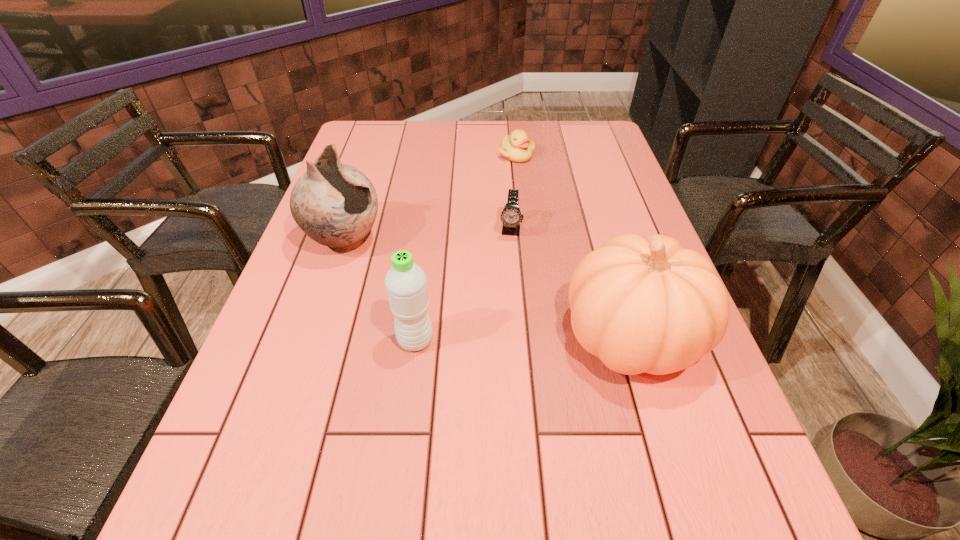
The width and height of the screenshot is (960, 540). I want to click on vacant space at the far edge of the desktop, so click(428, 150).

What are the coordinates of `vacant space at the near edge of the desktop` in the screenshot? It's located at (528, 458).

The width and height of the screenshot is (960, 540). I want to click on vacant area at the left edge, so 293,267.

Where is `free space at the right edge of the desktop`? The image size is (960, 540). free space at the right edge of the desktop is located at coordinates (589, 157).

You are a GUI agent. You are given a task and a screenshot of the screen. Output one action in this format:
    pyautogui.click(x=<x>, y=<y>)
    Task: Click on the free space at the far left corner of the desktop
    The width and height of the screenshot is (960, 540).
    Given the screenshot: What is the action you would take?
    pyautogui.click(x=367, y=122)

This screenshot has width=960, height=540. In the image, there is a desktop. In order to click on vacant area at the far right corner in this screenshot , I will do `click(609, 152)`.

Identify the location of free space at the near right corner. The width and height of the screenshot is (960, 540). (661, 453).

The width and height of the screenshot is (960, 540). I want to click on vacant space that is in between the watch and the water bottle, so click(463, 285).

I want to click on free point between the water bottle and the fourth tallest object, so click(x=463, y=285).

At what (x,y) coordinates should I click in order to perform the action: click on vacant space that's between the pumpkin and the leftmost object. Please return your answer as a coordinate pair (x, y). Looking at the image, I should click on (488, 289).